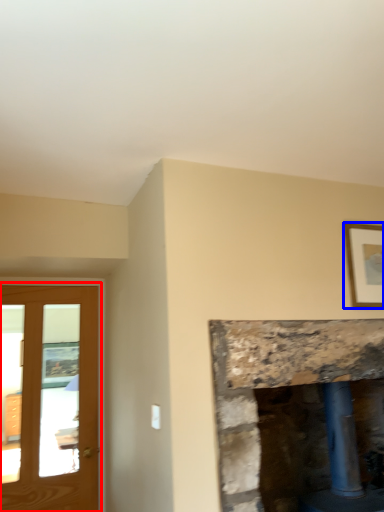
Question: Which object is closer to the camera taking this photo, screen door (highlighted by a red box) or picture frame (highlighted by a blue box)?

Choices:
 (A) screen door
 (B) picture frame

Answer: (B)